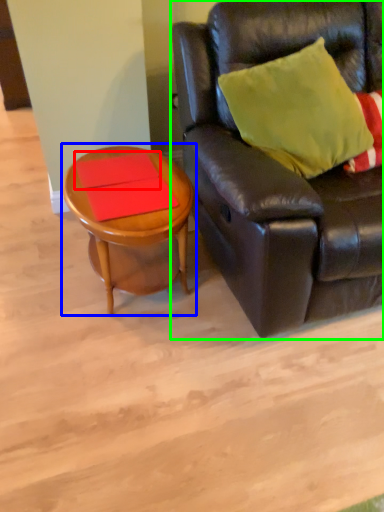
Question: Based on their relative distances, which object is nearer to plank (highlighted by a red box)? Choose from coffee table (highlighted by a blue box) and studio couch (highlighted by a green box).

Choices:
 (A) coffee table
 (B) studio couch

Answer: (A)